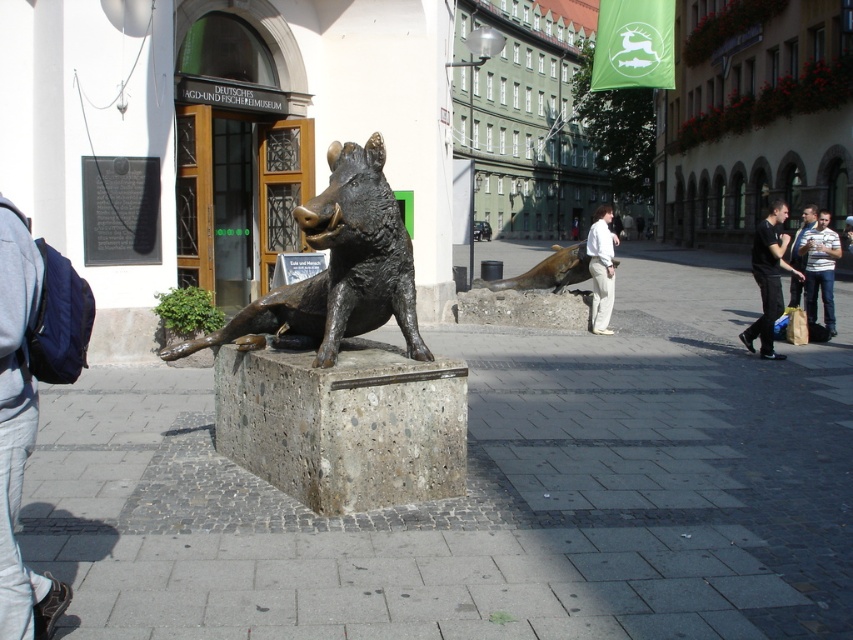
Describe the element at coordinates (338, 268) in the screenshot. I see `bronze/statue at center` at that location.

Is point (399, 308) less distant than point (831, 253)?

Yes, point (399, 308) is closer to viewer.

The width and height of the screenshot is (853, 640). I want to click on bronze/statue at center, so click(338, 268).

Where is `bronze/statue at center`? The width and height of the screenshot is (853, 640). bronze/statue at center is located at coordinates (338, 268).

Who is more distant from viewer, (395, 262) or (778, 205)?

The point (778, 205) is more distant.

Find the location of a particular element. The width and height of the screenshot is (853, 640). bronze/statue at center is located at coordinates (338, 268).

Who is more distant from viewer, (x=775, y=228) or (x=563, y=266)?

Positioned behind is point (x=563, y=266).

Is point (767, 280) closer to viewer compared to point (576, 252)?

Yes, it is in front of point (576, 252).

This screenshot has width=853, height=640. In order to click on black cotton shirt at right in this screenshot , I will do `click(769, 276)`.